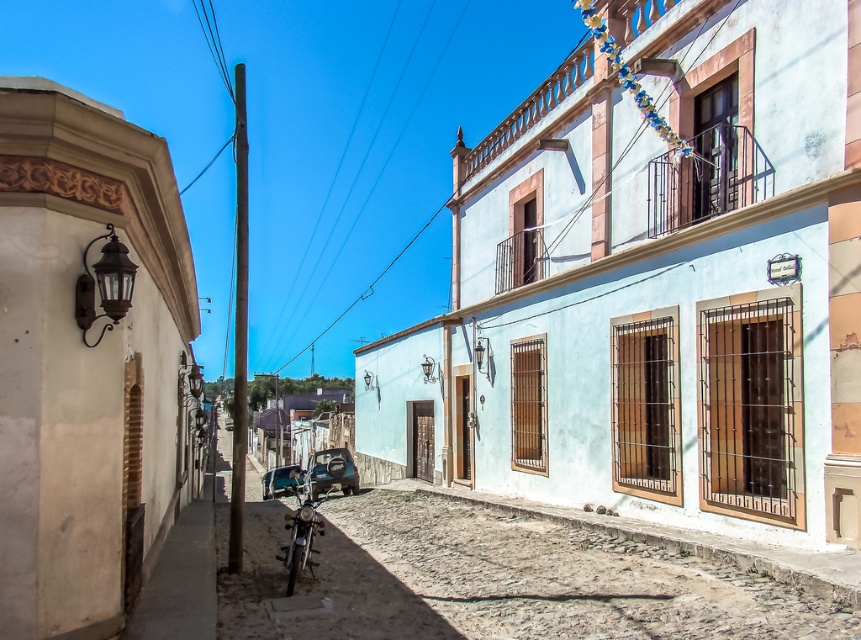
Is point (313, 532) in front of point (375, 180)?

That is True.

Is shiny chrome motorcycle at lower center smaller than clear plastic power lines at upper center?

Correct, shiny chrome motorcycle at lower center occupies less space than clear plastic power lines at upper center.

Which is in front, point (288, 554) or point (347, 234)?

Positioned in front is point (288, 554).

The image size is (861, 640). I want to click on shiny chrome motorcycle at lower center, so click(300, 538).

In the scene shown: Does shiny chrome motorcycle at lower center have a lesser width compared to brown wooden pole at center?

Yes.

Between shiny chrome motorcycle at lower center and brown wooden pole at center, which one is positioned lower?

shiny chrome motorcycle at lower center

Identify the location of shiny chrome motorcycle at lower center. This screenshot has height=640, width=861. (300, 538).

Based on the photo, does clear plastic power lines at upper center have a larger size compared to brown wooden pole at center?

Actually, clear plastic power lines at upper center might be smaller than brown wooden pole at center.

How much distance is there between clear plastic power lines at upper center and brown wooden pole at center?

The distance of clear plastic power lines at upper center from brown wooden pole at center is 25.01 feet.

Is point (412, 115) positioned after point (424, 228)?

That is True.

At what (x,y) coordinates should I click in order to perform the action: click on clear plastic power lines at upper center. Please return your answer as a coordinate pair (x, y). This screenshot has width=861, height=640. Looking at the image, I should click on (430, 74).